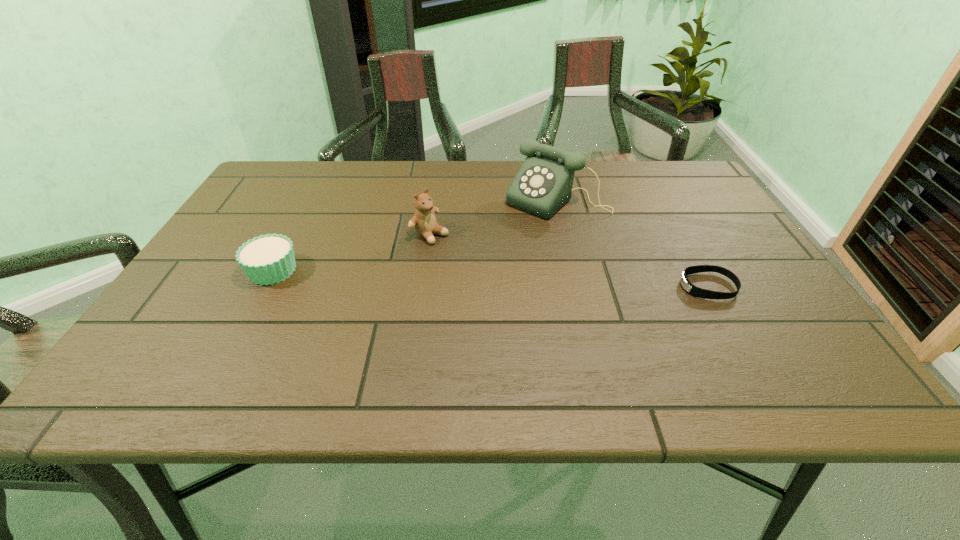
Locate an element on the screen. This screenshot has height=540, width=960. vacant area that lies between the telephone and the leftmost object is located at coordinates (415, 235).

This screenshot has height=540, width=960. I want to click on free spot between the third object from right to left and the cupcake, so click(351, 252).

At what (x,y) coordinates should I click in order to perform the action: click on unoccupied position between the third shortest object and the leftmost object. Please return your answer as a coordinate pair (x, y). Image resolution: width=960 pixels, height=540 pixels. Looking at the image, I should click on (351, 252).

Identify the location of vacant area between the leftmost object and the shortest object. This screenshot has height=540, width=960. (491, 278).

Identify the location of free space between the tallest object and the shortest object. coord(633,243).

Locate an element on the screen. free space between the telephone and the shortest object is located at coordinates (633, 243).

Locate an element on the screen. Image resolution: width=960 pixels, height=540 pixels. empty space that is in between the third object from left to right and the wristband is located at coordinates (633, 243).

Select which object appears as the second closest to the shortest object. Please provide its 2D coordinates. Your answer should be formatted as a tuple, i.e. [(x, y)], where the tuple contains the x and y coordinates of a point satisfying the conditions above.

[(424, 222)]

Locate an element on the screen. Image resolution: width=960 pixels, height=540 pixels. the second closest object to the second object from right to left is located at coordinates (691, 289).

This screenshot has height=540, width=960. Identify the location of vacant space that satisfies the following two spatial constraints: 1. on the back side of the farthest object; 2. on the left side of the second farthest object. (435, 200).